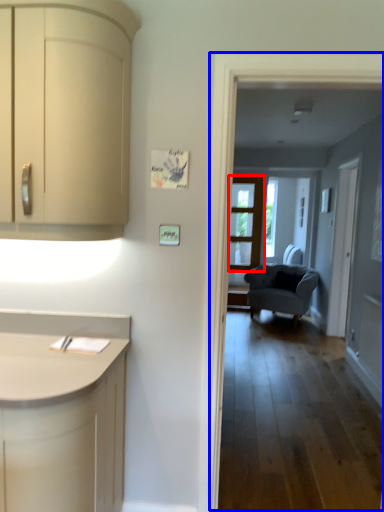
Question: Among these objects, which one is nearest to the camera, door (highlighted by a red box) or corridor (highlighted by a blue box)?

Choices:
 (A) door
 (B) corridor

Answer: (B)